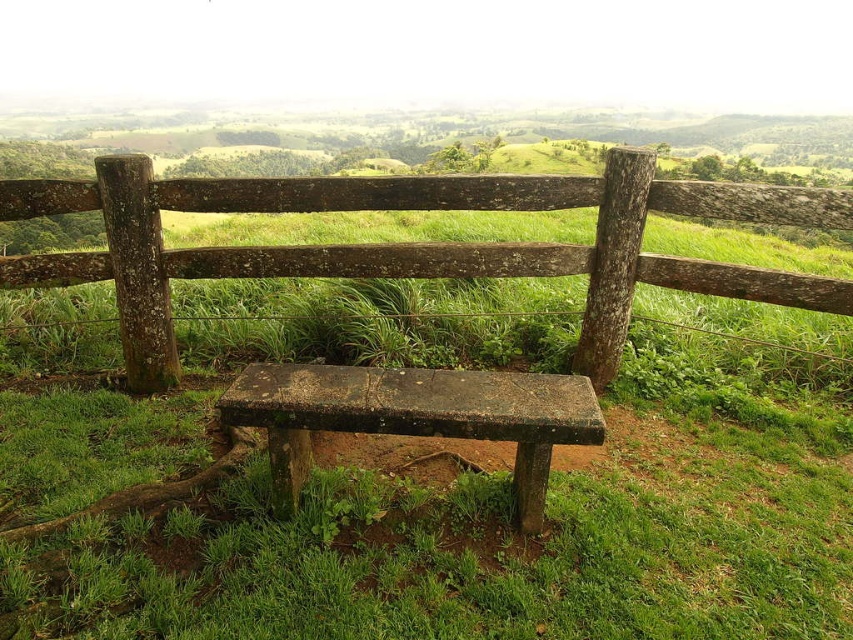
Can you confirm if weathered wood fence at center is thinner than rusty concrete bench at center?

In fact, weathered wood fence at center might be wider than rusty concrete bench at center.

Identify the location of weathered wood fence at center. (412, 243).